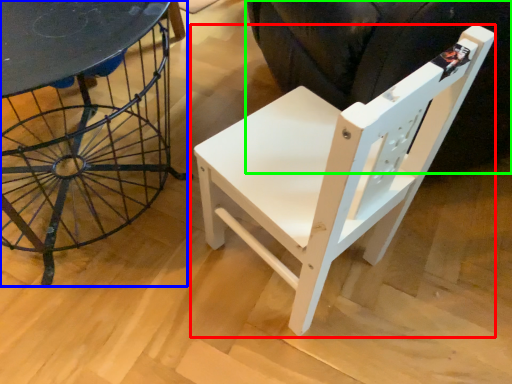
Question: Based on their relative distances, which object is farther from chair (highlighted by a red box)? Choose from table (highlighted by a blue box) and swivel chair (highlighted by a green box).

Choices:
 (A) table
 (B) swivel chair

Answer: (A)